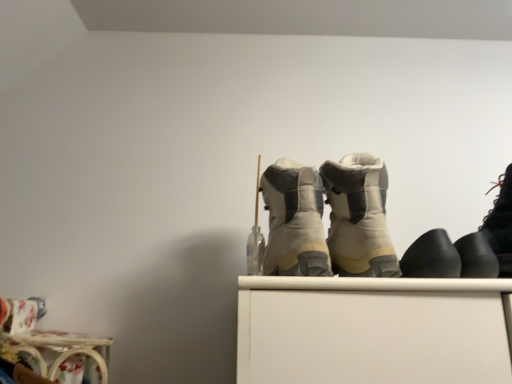
Question: Does beige suede boots at center, positioned as the second footwear in left-to-right order, have a larger size compared to black matte boot at right, marked as the third footwear in a right-to-left arrangement?

Choices:
 (A) yes
 (B) no

Answer: (A)

Question: Is there a large distance between beige suede boots at center, positioned as the second footwear in left-to-right order, and black matte boot at right, which is the 3th footwear from left to right?

Choices:
 (A) yes
 (B) no

Answer: (B)

Question: Is beige suede boots at center, positioned as the second footwear in left-to-right order, taller than black matte boot at right, which is the 3th footwear from left to right?

Choices:
 (A) no
 (B) yes

Answer: (B)

Question: Does beige suede boots at center, which appears as the fourth footwear when viewed from the right, have a lesser height compared to black matte boot at right, which is the 3th footwear from left to right?

Choices:
 (A) no
 (B) yes

Answer: (A)

Question: From the image's perspective, is beige suede boots at center, positioned as the second footwear in left-to-right order, on black matte boot at right, which is the 3th footwear from left to right?

Choices:
 (A) no
 (B) yes

Answer: (B)

Question: Visually, is black leather boot at right, positioned as the first footwear in right-to-left order, positioned to the left or to the right of black rubber shoes at right, the 2th footwear positioned from the right?

Choices:
 (A) right
 (B) left

Answer: (A)

Question: Looking at their shapes, would you say black leather boot at right, positioned as the first footwear in right-to-left order, is wider or thinner than black rubber shoes at right, the 2th footwear positioned from the right?

Choices:
 (A) wide
 (B) thin

Answer: (A)

Question: From a real-world perspective, relative to black rubber shoes at right, which is the fourth footwear from left to right, is black leather boot at right, positioned as the first footwear in right-to-left order, vertically above or below?

Choices:
 (A) below
 (B) above

Answer: (B)

Question: Is black leather boot at right, the fifth footwear positioned from the left, inside or outside of black rubber shoes at right, the 2th footwear positioned from the right?

Choices:
 (A) outside
 (B) inside

Answer: (A)

Question: Is point (315, 172) positioned closer to the camera than point (421, 271)?

Choices:
 (A) closer
 (B) farther

Answer: (B)

Question: Considering the positions of beige suede boots at center, placed as the fifth footwear when sorted from right to left, and black matte boot at right, which is the 3th footwear from left to right, in the image, is beige suede boots at center, placed as the fifth footwear when sorted from right to left, taller or shorter than black matte boot at right, which is the 3th footwear from left to right,?

Choices:
 (A) short
 (B) tall

Answer: (B)

Question: Visually, is beige suede boots at center, which is counted as the 1th footwear, starting from the left, positioned to the left or to the right of black matte boot at right, marked as the third footwear in a right-to-left arrangement?

Choices:
 (A) left
 (B) right

Answer: (A)

Question: Based on their sizes in the image, would you say beige suede boots at center, placed as the fifth footwear when sorted from right to left, is bigger or smaller than black matte boot at right, marked as the third footwear in a right-to-left arrangement?

Choices:
 (A) small
 (B) big

Answer: (B)

Question: Based on their sizes in the image, would you say black rubber shoes at right, which is the fourth footwear from left to right, is bigger or smaller than black matte boot at right, which is the 3th footwear from left to right?

Choices:
 (A) small
 (B) big

Answer: (A)

Question: From the image's perspective, is black rubber shoes at right, the 2th footwear positioned from the right, positioned above or below black matte boot at right, which is the 3th footwear from left to right?

Choices:
 (A) above
 (B) below

Answer: (B)